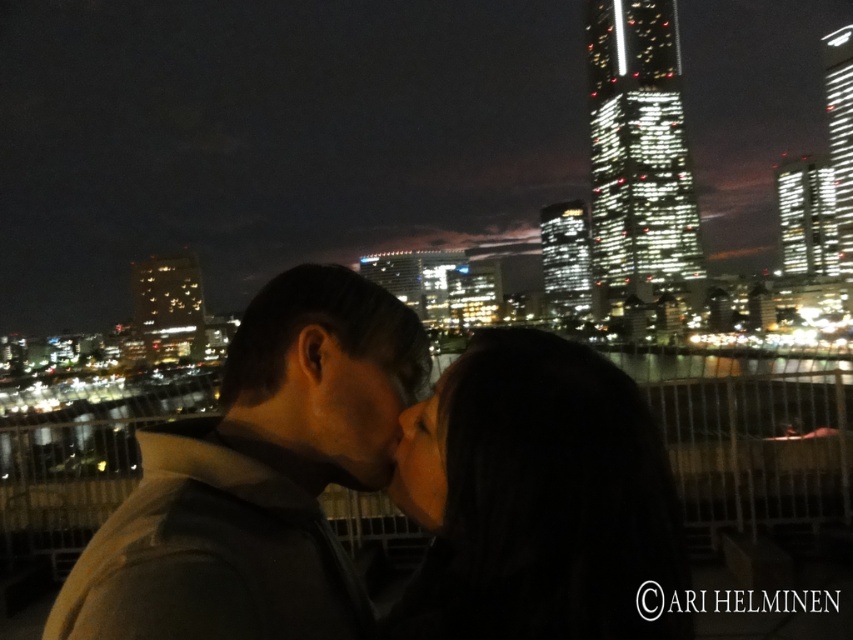
You are a photographer trying to capture a closeup of the dark brown leather jacket at center and the dark hair at center. Which object should you focus on first if you want to ensure both are in focus without adjusting the camera settings?

The dark brown leather jacket at center is wider than dark hair at center, so focusing on the wider object first would increase the chance of both being in focus.

You are a photographer trying to capture the couple in the scene. You notice the dark brown leather jacket at center and the dark hair at center. Which object is closer to the camera lens? Explain your reasoning based on their positions.

The dark brown leather jacket at center is positioned over dark hair at center, meaning it is closer to the camera lens. Since the jacket is layered over the hair in the composition, it blocks the view of the hair slightly, indicating proximity to the viewer.